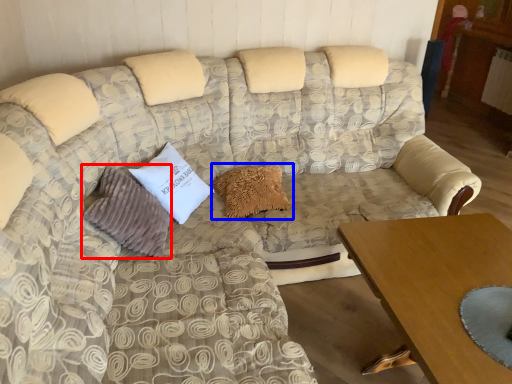
Question: Which object appears farthest to the camera in this image, pillow (highlighted by a red box) or pillow (highlighted by a blue box)?

Choices:
 (A) pillow
 (B) pillow

Answer: (B)